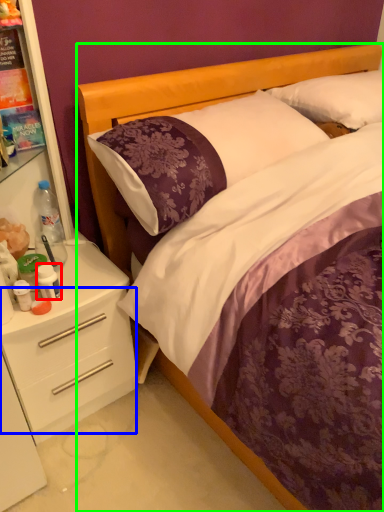
Question: Estimate the real-world distances between objects in this image. Which object is farther from bottle (highlighted by a red box), drawer (highlighted by a blue box) or bed (highlighted by a green box)?

Choices:
 (A) drawer
 (B) bed

Answer: (B)